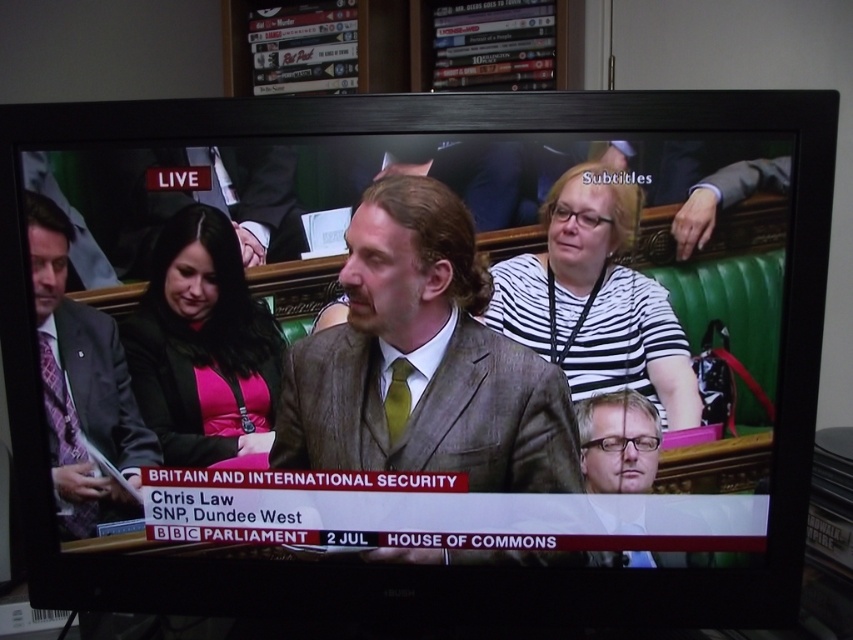
Question: Which is farther from the matte purple tie at left?

Choices:
 (A) matte brown suit at center
 (B) pink fabric at center

Answer: (A)

Question: Considering the real-world distances, which object is closest to the pink fabric at center?

Choices:
 (A) matte brown suit at center
 (B) striped fabric shirt at center
 (C) matte purple tie at left

Answer: (C)

Question: Does matte brown suit at center have a larger size compared to pink fabric at center?

Choices:
 (A) no
 (B) yes

Answer: (B)

Question: Does matte brown suit at center appear on the right side of matte purple tie at left?

Choices:
 (A) yes
 (B) no

Answer: (A)

Question: Which object is the closest to the striped fabric shirt at center?

Choices:
 (A) matte purple tie at left
 (B) matte brown suit at center
 (C) pink fabric at center

Answer: (B)

Question: Does striped fabric shirt at center appear under pink fabric at center?

Choices:
 (A) no
 (B) yes

Answer: (A)